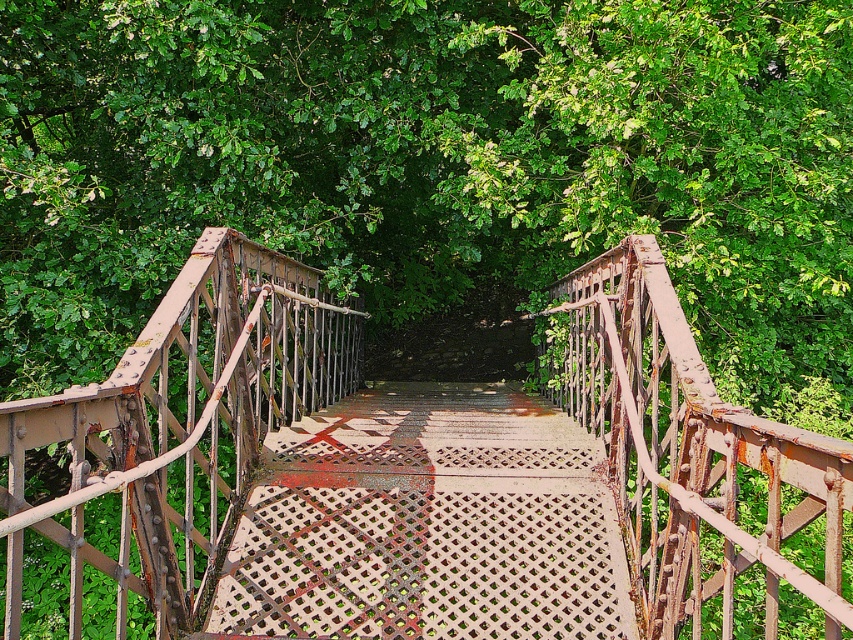
Which is behind, point (408, 627) or point (544, 481)?

Point (544, 481)

Between point (201, 513) and point (395, 544), which one is positioned in front?

Point (395, 544) is in front.

At what (x,y) coordinates should I click in order to perform the action: click on rusty metal bridge at center. Please return your answer as a coordinate pair (x, y). Looking at the image, I should click on (421, 477).